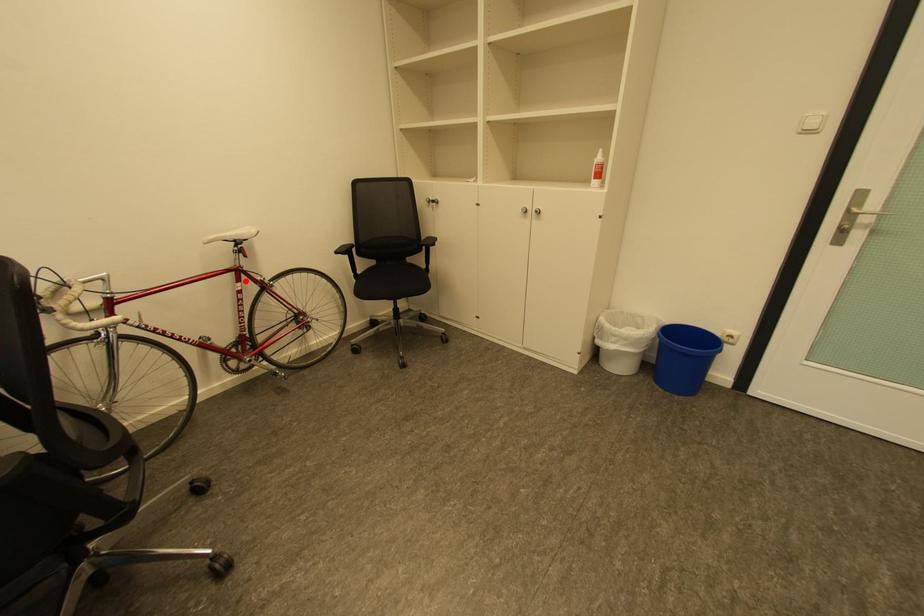
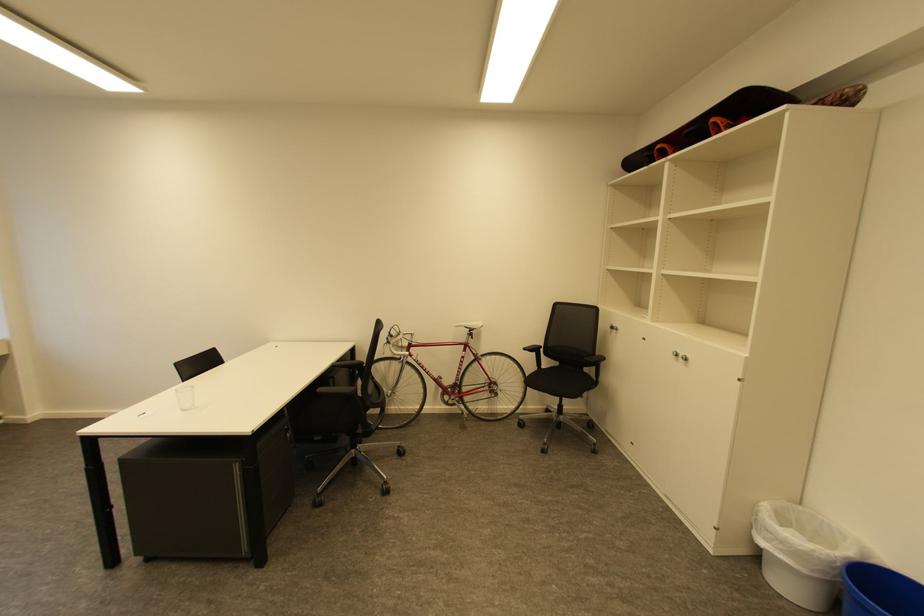
Where in the second image is the point corresponding to the highlighted location from the first image?

(471, 351)